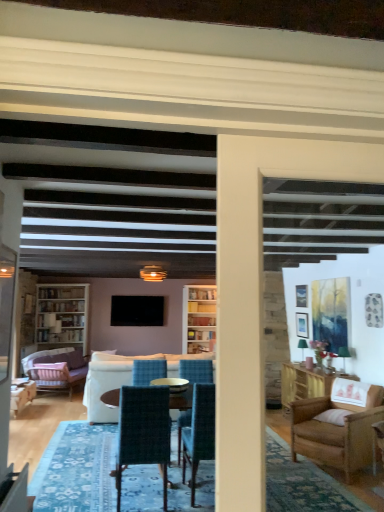
Question: Looking at their shapes, would you say white wood bookcase at left is wider or thinner than velvet pink armchair at lower left, acting as the 3th chair starting from the right?

Choices:
 (A) thin
 (B) wide

Answer: (A)

Question: From the image's perspective, is white wood bookcase at left positioned above or below velvet pink armchair at lower left, the first chair viewed from the left?

Choices:
 (A) above
 (B) below

Answer: (A)

Question: Which is farther from the white wood bookcase at left?

Choices:
 (A) velvet purple couch at left, which is counted as the 1th studio couch, starting from the left
 (B) velvet pink armchair at lower left, which is counted as the 1th chair, starting from the back
 (C) white fabric couch at center, which appears as the first studio couch when viewed from the right
 (D) velvet teal chair at center, the first chair from the front
 (E) velvet teal chair at center, which is counted as the second chair, starting from the back

Answer: (E)

Question: Which of these objects is positioned farthest from the white wood bookcase at left?

Choices:
 (A) white fabric couch at center, which appears as the first studio couch when viewed from the right
 (B) velvet teal chair at center, the first chair from the front
 (C) velvet purple couch at left, the 2th studio couch positioned from the right
 (D) flat screen tv at center
 (E) velvet teal chair at center, which is counted as the second chair, starting from the back

Answer: (E)